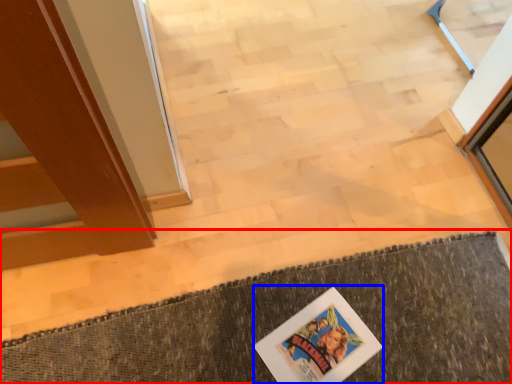
Question: Which object is closer to the camera taking this photo, bath mat (highlighted by a red box) or comic book (highlighted by a blue box)?

Choices:
 (A) bath mat
 (B) comic book

Answer: (A)